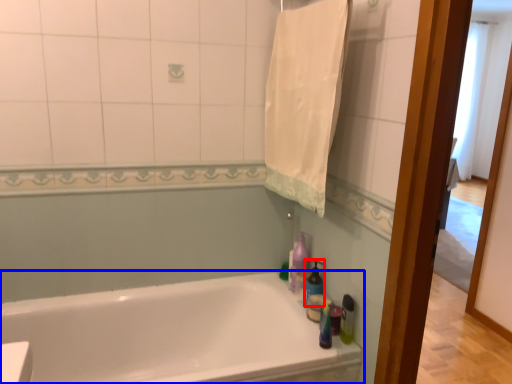
Question: Which object appears closest to the camera in this image, cleaning product (highlighted by a red box) or bathtub (highlighted by a blue box)?

Choices:
 (A) cleaning product
 (B) bathtub

Answer: (B)